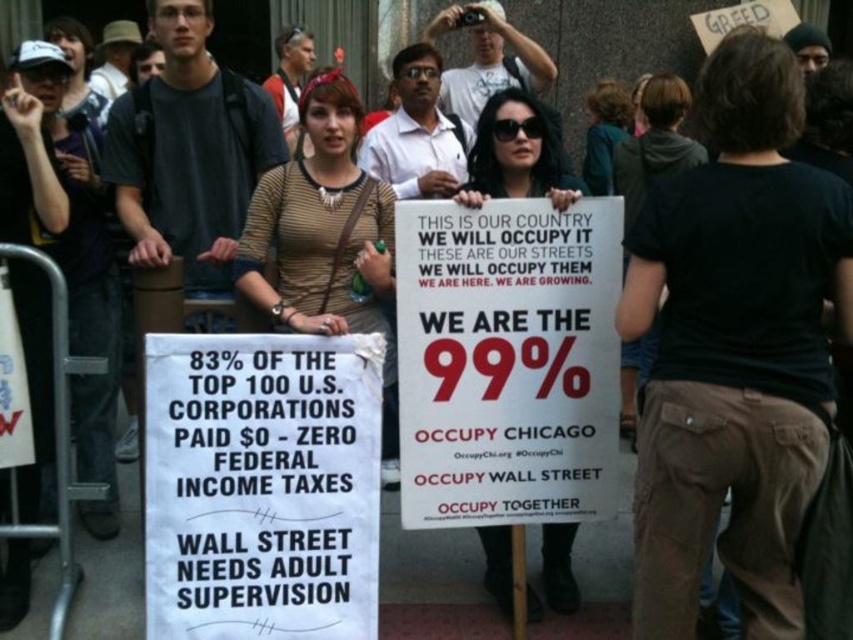
Question: Which object appears closest to the camera in this image?

Choices:
 (A) striped fabric shirt at center
 (B) black cotton shirt at upper right

Answer: (A)

Question: Considering the relative positions of striped fabric shirt at center and black cotton shirt at upper right in the image provided, where is striped fabric shirt at center located with respect to black cotton shirt at upper right?

Choices:
 (A) above
 (B) below

Answer: (B)

Question: Which object appears closest to the camera in this image?

Choices:
 (A) striped fabric shirt at center
 (B) black cotton shirt at upper right
 (C) matte white sign at center

Answer: (A)

Question: Does matte white sign at center lie in front of black cotton shirt at upper right?

Choices:
 (A) yes
 (B) no

Answer: (A)

Question: Which point appears farthest from the camera in this image?

Choices:
 (A) 677,170
 (B) 428,324
 (C) 556,531
 (D) 395,467

Answer: (A)

Question: Is striped fabric shirt at center further to camera compared to black cotton shirt at upper right?

Choices:
 (A) yes
 (B) no

Answer: (B)